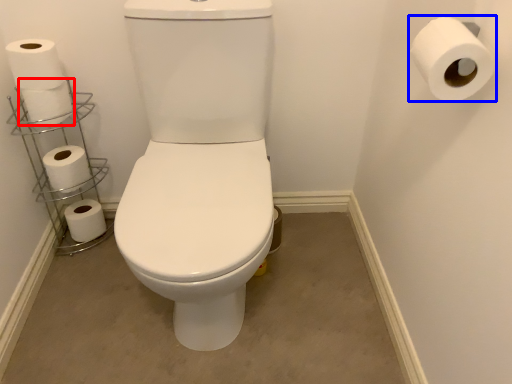
Question: Which point is closer to the camera, toilet paper (highlighted by a red box) or toilet paper (highlighted by a blue box)?

Choices:
 (A) toilet paper
 (B) toilet paper

Answer: (B)